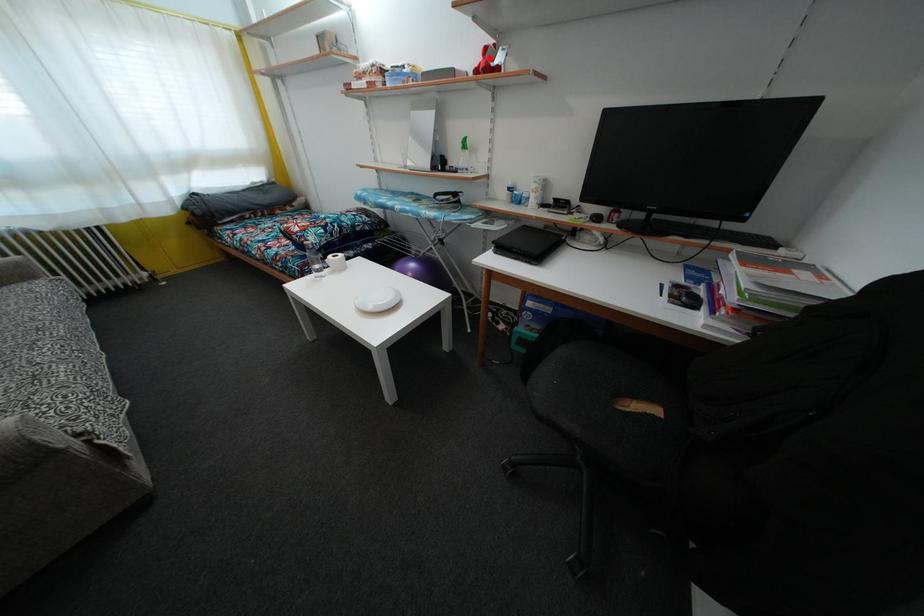
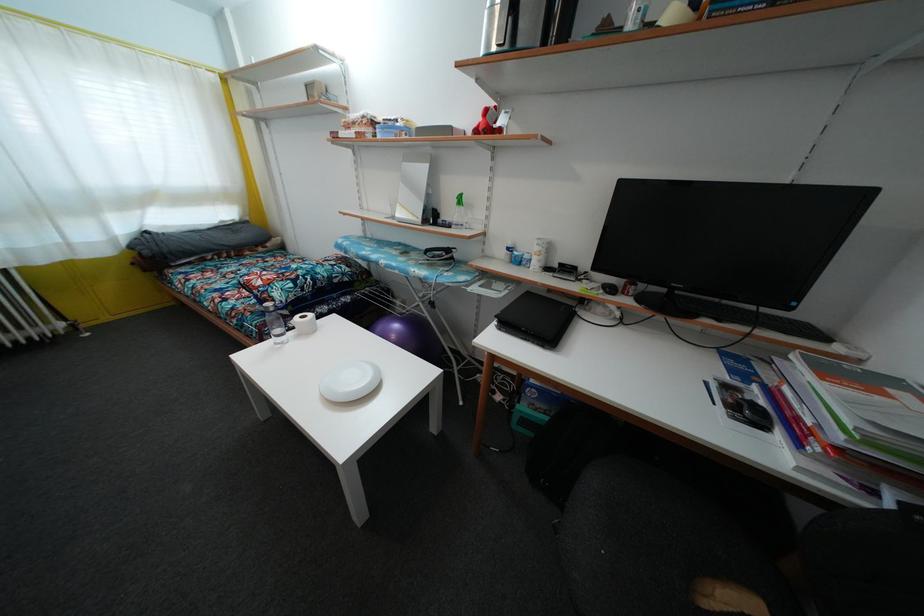
In the second image, find the point that corresponds to the highlighted location in the first image.

(490, 119)